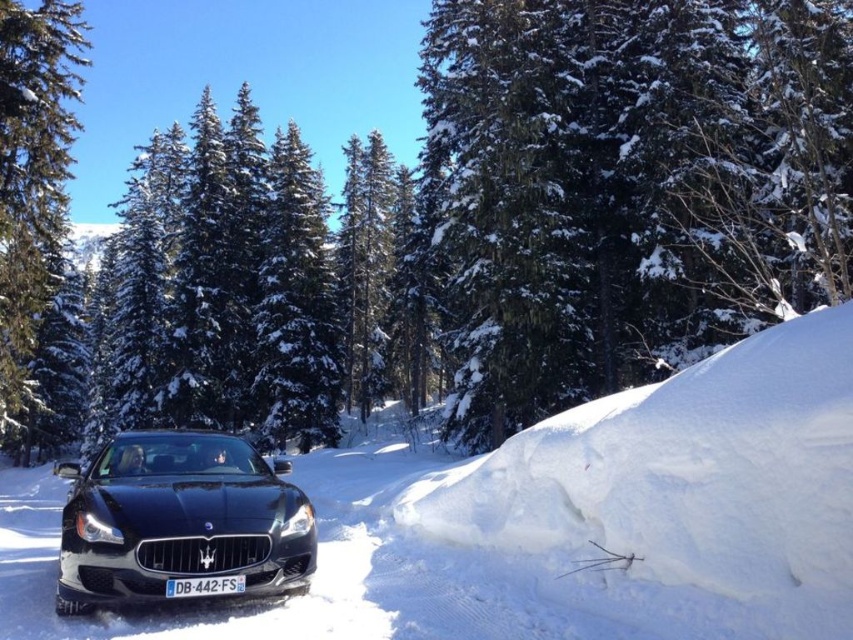
Question: Which object is positioned farthest from the glossy black car at center?

Choices:
 (A) green textured pine tree at upper left
 (B) white fluffy snow at center

Answer: (A)

Question: Can you confirm if white fluffy snow at center is positioned to the right of green textured pine tree at upper left?

Choices:
 (A) no
 (B) yes

Answer: (B)

Question: Does glossy black car at center have a greater width compared to white plastic license plate at center?

Choices:
 (A) no
 (B) yes

Answer: (A)

Question: Based on their relative distances, which object is nearer to the white fluffy snow at center?

Choices:
 (A) glossy black car at center
 (B) green textured pine tree at upper left
 (C) white plastic license plate at center

Answer: (C)

Question: Which of these objects is positioned closest to the white plastic license plate at center?

Choices:
 (A) white fluffy snow at center
 (B) glossy black car at center
 (C) green textured pine tree at upper left

Answer: (A)

Question: Observing the image, what is the correct spatial positioning of glossy black car at center in reference to green textured pine tree at upper left?

Choices:
 (A) below
 (B) above

Answer: (A)